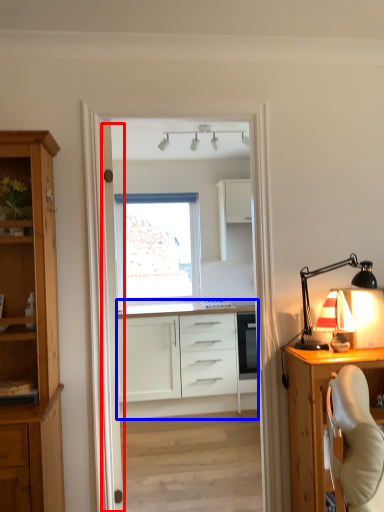
Question: Which point is further to the camera, door (highlighted by a red box) or cabinetry (highlighted by a blue box)?

Choices:
 (A) door
 (B) cabinetry

Answer: (B)